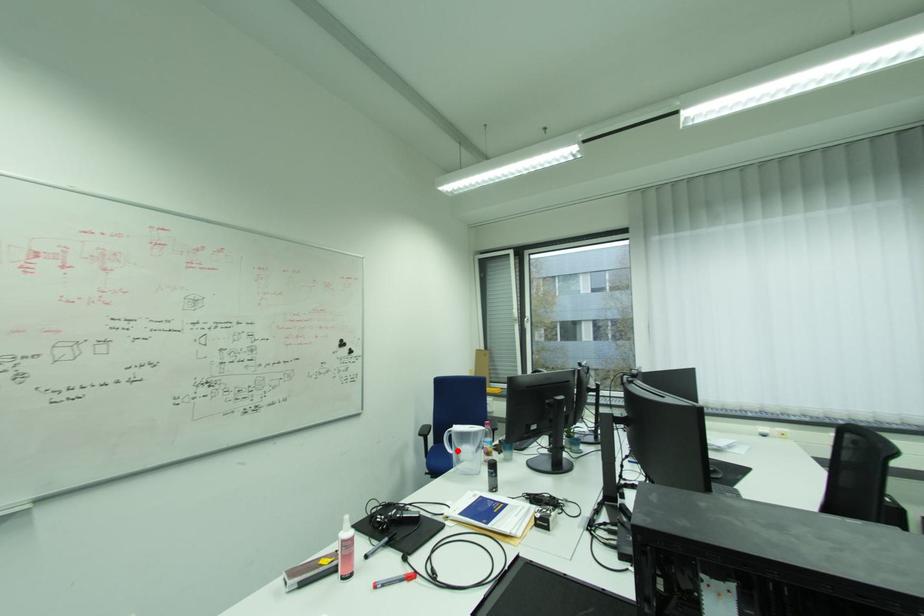
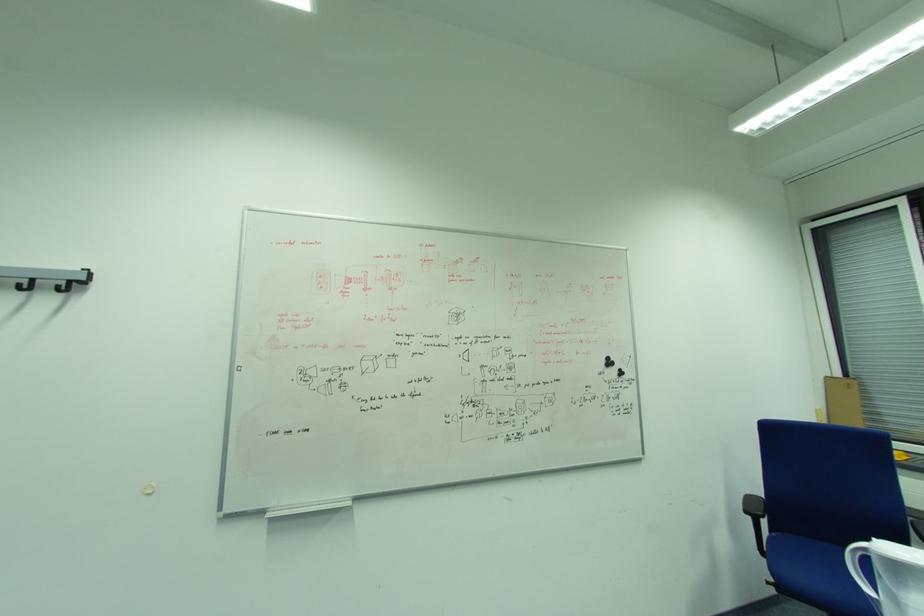
Question: I am providing you with two images of the same scene from different viewpoints. A red point is shown in image1. For the corresponding object point in image2, is it positioned nearer or farther from the camera?

Choices:
 (A) Nearer
 (B) Farther

Answer: (A)